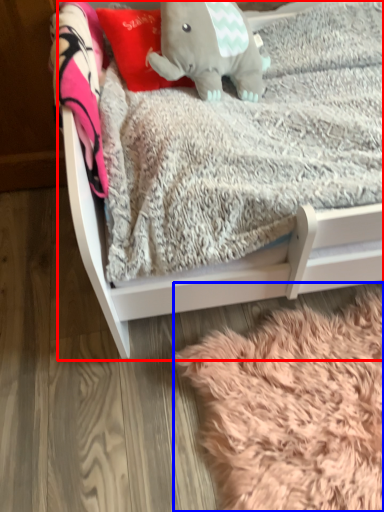
Question: Which object is closer to the camera taking this photo, infant bed (highlighted by a red box) or blanket (highlighted by a blue box)?

Choices:
 (A) infant bed
 (B) blanket

Answer: (A)